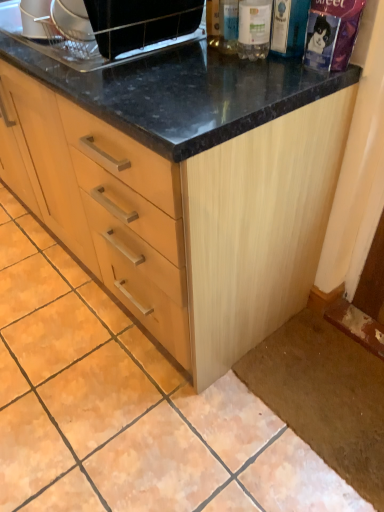
Locate an element on the screen. The height and width of the screenshot is (512, 384). free space in front of black glossy microwave at upper center is located at coordinates (147, 76).